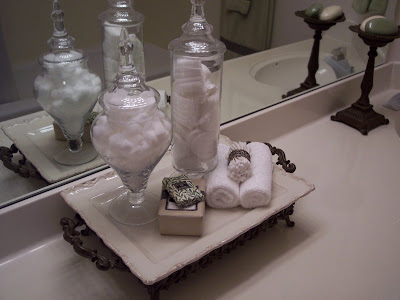
What are the coordinates of `rolled up white hand towel` in the screenshot? It's located at (221, 186), (257, 188).